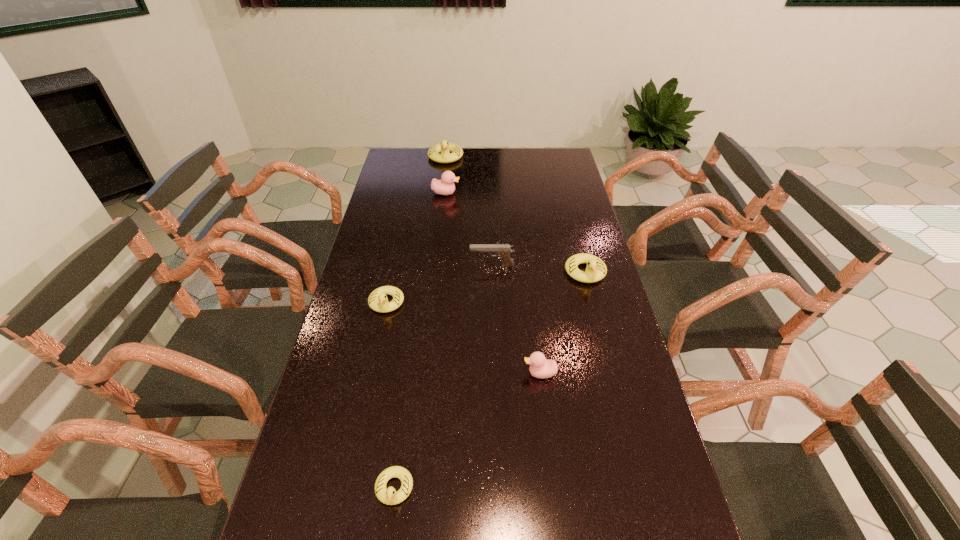
Where is `the farthest duckling`? The height and width of the screenshot is (540, 960). the farthest duckling is located at coordinates (444, 147).

Find the location of a particular element. The height and width of the screenshot is (540, 960). the farthest yellow duckling is located at coordinates (444, 147).

Image resolution: width=960 pixels, height=540 pixels. In order to click on the bigger pink duckling in this screenshot , I will do `click(445, 186)`.

At what (x,y) coordinates should I click in order to perform the action: click on the sixth nearest object. Please return your answer as a coordinate pair (x, y). This screenshot has height=540, width=960. Looking at the image, I should click on (445, 186).

This screenshot has height=540, width=960. What are the coordinates of `the third object from right to left` in the screenshot? It's located at (503, 251).

Where is `the second biggest yellow duckling`? This screenshot has height=540, width=960. the second biggest yellow duckling is located at coordinates point(596,269).

Where is `the third nearest yellow duckling`? the third nearest yellow duckling is located at coordinates (596, 269).

This screenshot has width=960, height=540. What are the coordinates of `the fifth farthest duckling` in the screenshot? It's located at (540, 367).

The width and height of the screenshot is (960, 540). In order to click on the smaller pink duckling in this screenshot , I will do `click(540, 367)`.

You are a GUI agent. You are given a task and a screenshot of the screen. Output one action in this format:
    pyautogui.click(x=<x>, y=<y>)
    Task: Click on the third nearest duckling
    
    Given the screenshot: What is the action you would take?
    pyautogui.click(x=378, y=301)